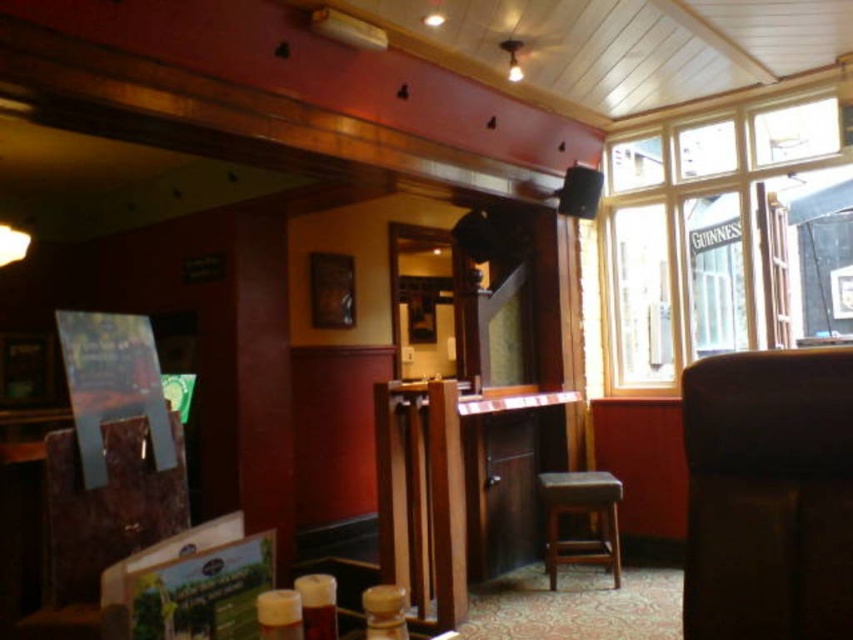
Based on the photo, you are a bartender who needs to move a tray of drinks from the counter to the clear glass window at upper right. The tray is 1.5 meters long. Can you safely carry it horizontally without hitting anything?

The distance between the counter and the clear glass window at upper right is 4.11 meters, which is greater than the tray length of 1.5 meters. Yes, you can safely carry the tray horizontally without hitting anything.

You are standing in the pub and want to look outside through the clear glass window at upper right. Based on its position, where should you look relative to the counter area?

The clear glass window at upper right is located at point (x=705, y=234), so you should look towards the upper right area relative to the counter area to see outside.